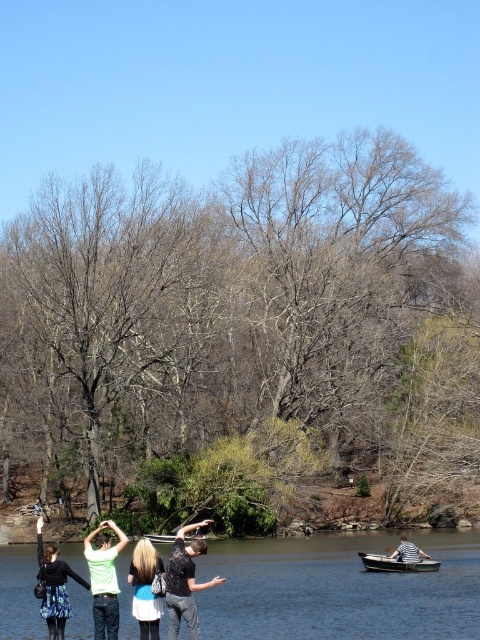
Does blue water at lower center have a lesser height compared to striped fabric boat at lower right?

In fact, blue water at lower center may be taller than striped fabric boat at lower right.

Which is behind, point (312, 625) or point (405, 554)?

The point (405, 554) is behind.

Image resolution: width=480 pixels, height=640 pixels. Find the location of `blue water at lower center`. blue water at lower center is located at coordinates (338, 589).

Can you confirm if green matte shirt at center is shorter than blue denim jacket at center?

Indeed, green matte shirt at center has a lesser height compared to blue denim jacket at center.

Is point (99, 564) closer to camera compared to point (135, 618)?

No, (99, 564) is behind (135, 618).

Identify the location of green matte shirt at center. (104, 579).

Does black matte shirt at center have a greater height compared to wooden canoe at lower center?

Yes, black matte shirt at center is taller than wooden canoe at lower center.

In the scene shown: Between black matte shirt at center and wooden canoe at lower center, which one appears on the right side from the viewer's perspective?

wooden canoe at lower center

Does point (175, 632) come closer to viewer compared to point (396, 556)?

Yes.

I want to click on black matte shirt at center, so click(184, 580).